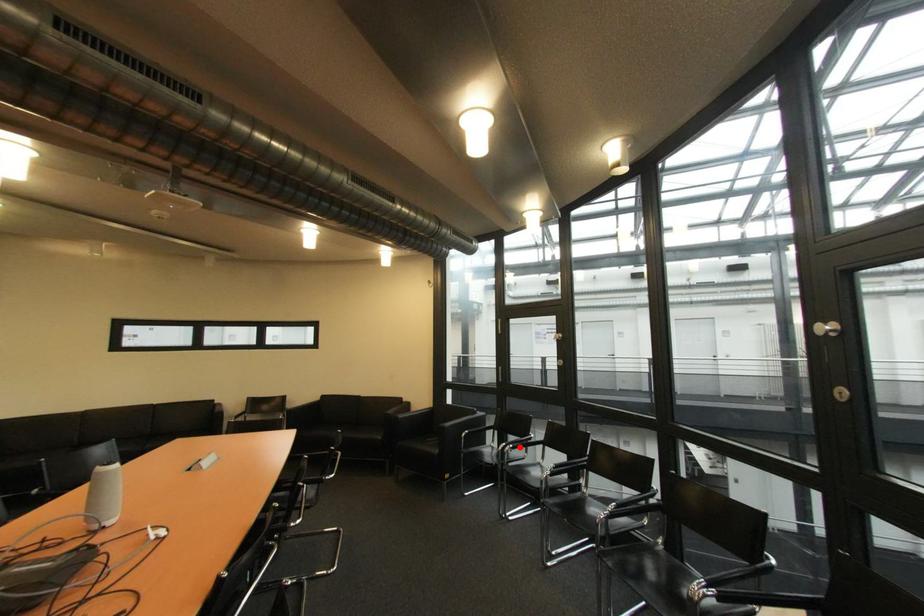
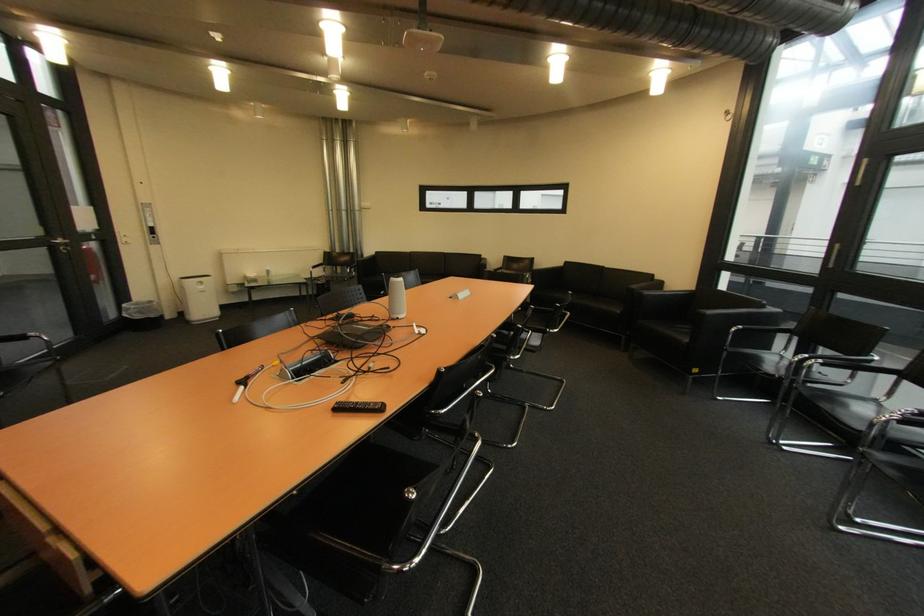
Find the pixel in the second image that matches the highlighted location in the first image.

(829, 362)